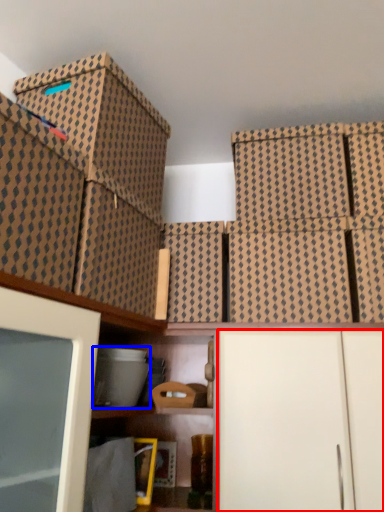
Question: Which object appears closest to the camera in this image, cabinetry (highlighted by a red box) or storage box (highlighted by a blue box)?

Choices:
 (A) cabinetry
 (B) storage box

Answer: (A)